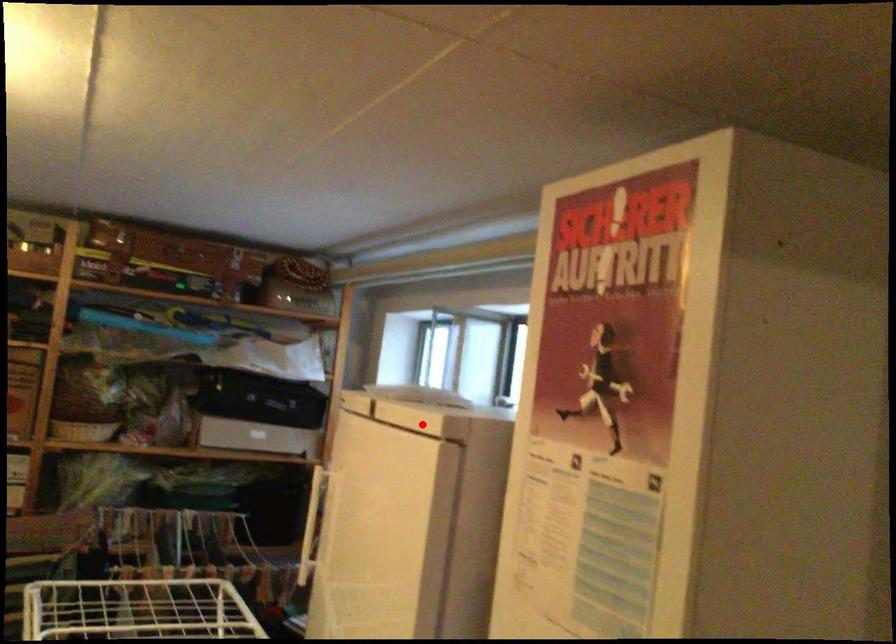
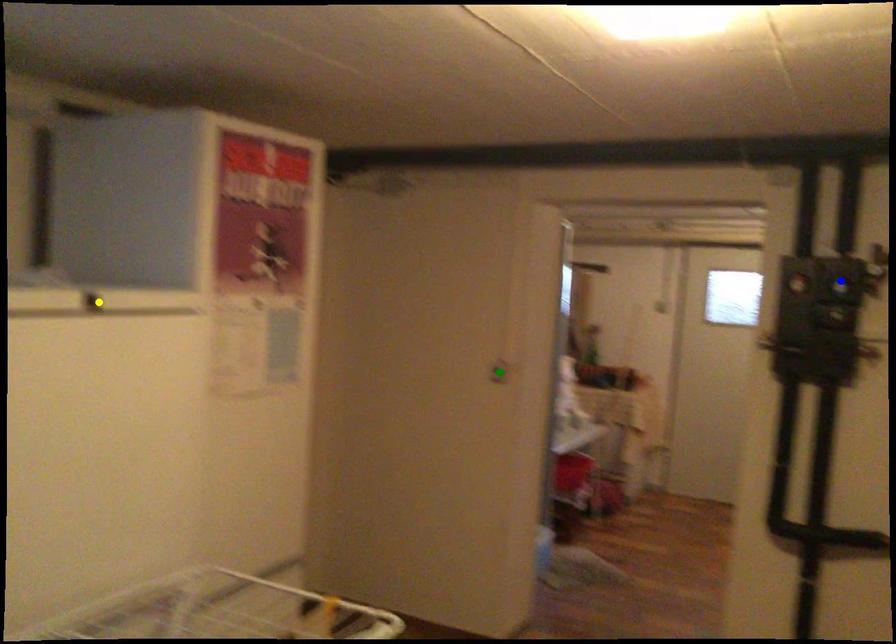
Question: I am providing you with two images of the same scene from different viewpoints. A red point is marked on the first image. You are given multiple points on the second image. Which point in image 2 represents the same 3d spot as the red point in image 1?

Choices:
 (A) blue point
 (B) yellow point
 (C) green point

Answer: (B)